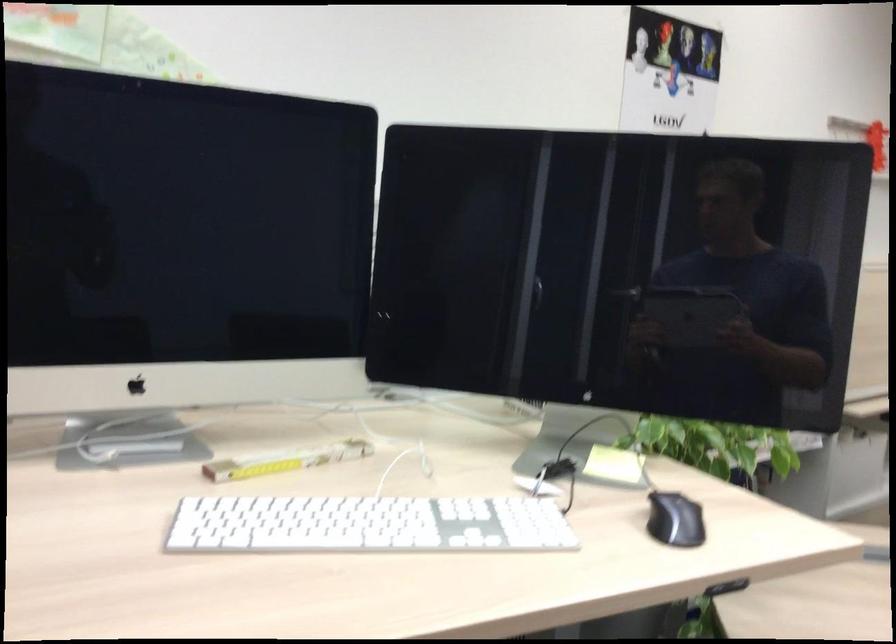
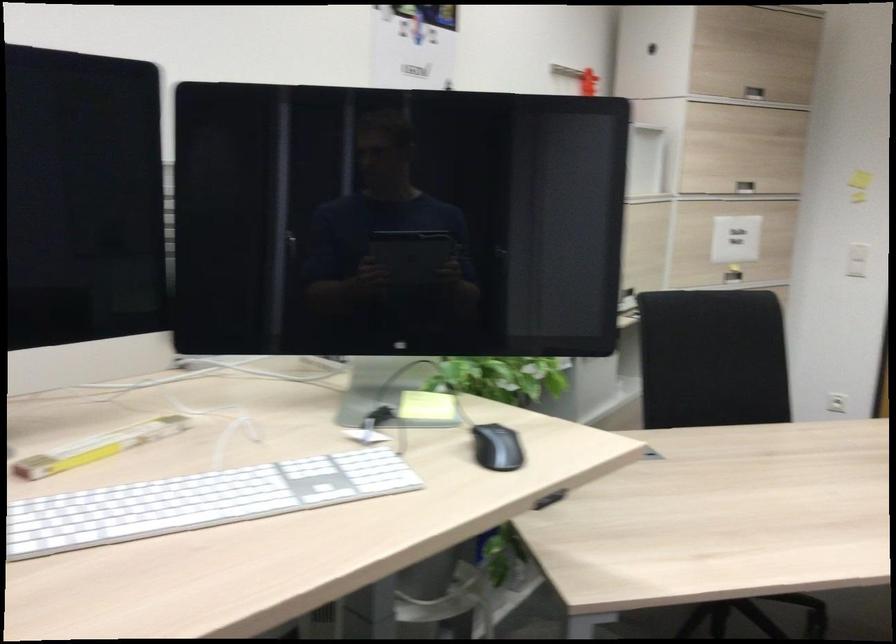
The point at [673,521] is marked in the first image. Where is the corresponding point in the second image?

(496, 448)